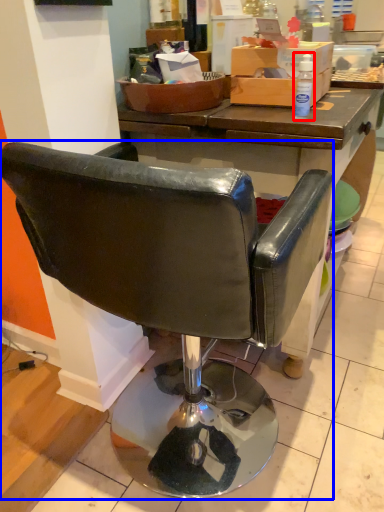
Question: Among these objects, which one is farthest to the camera, bottle (highlighted by a red box) or chair (highlighted by a blue box)?

Choices:
 (A) bottle
 (B) chair

Answer: (A)